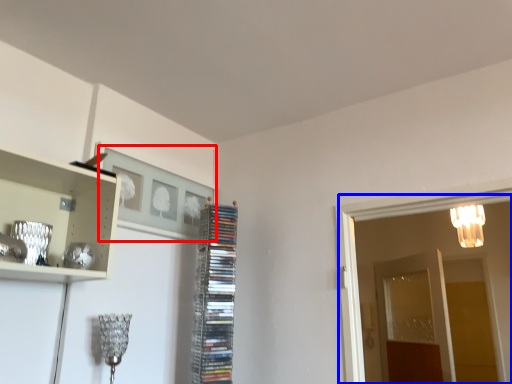
Question: Which point is further to the camera, picture frame (highlighted by a red box) or glass door (highlighted by a blue box)?

Choices:
 (A) picture frame
 (B) glass door

Answer: (B)